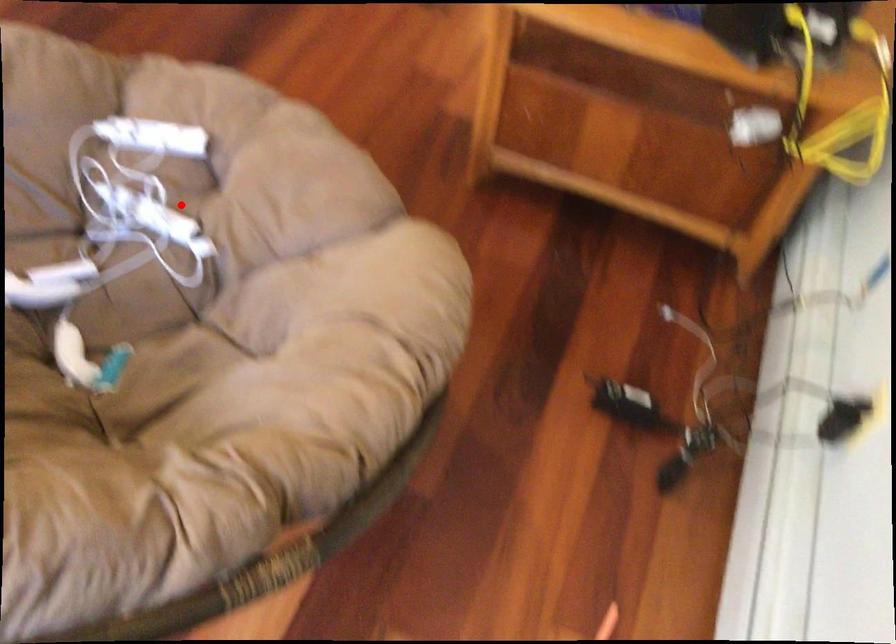
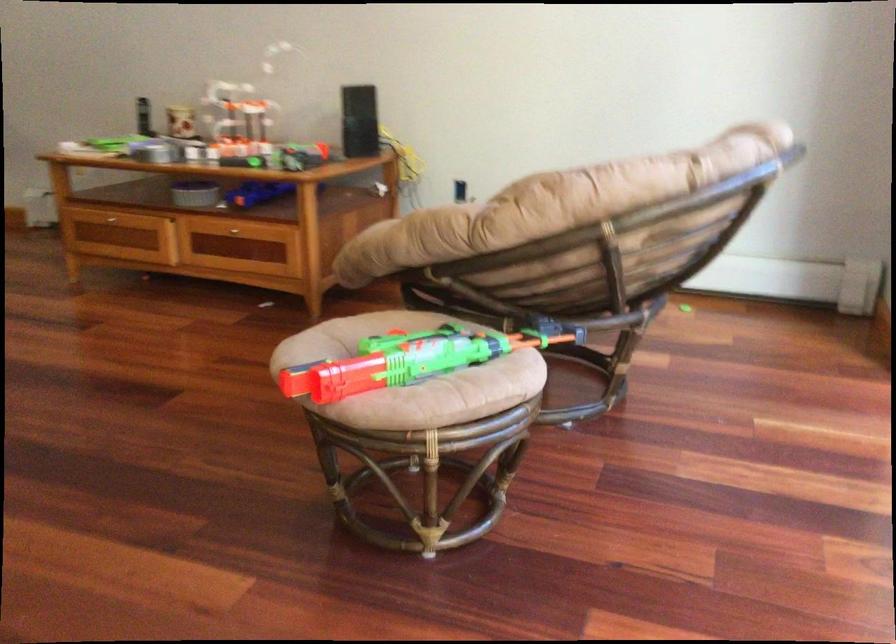
Question: I am providing you with two images of the same scene from different viewpoints. A red point is marked on the first image. Is the red point's position out of view in image 2?

Choices:
 (A) Yes
 (B) No

Answer: (A)